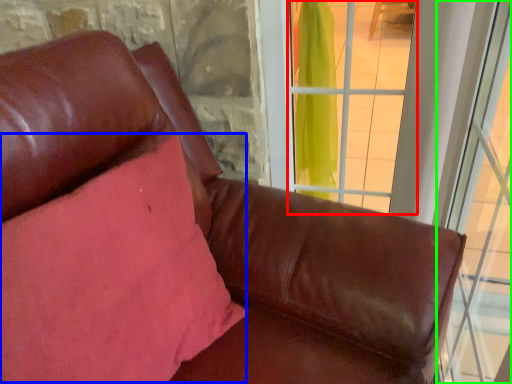
Question: Estimate the real-world distances between objects in this image. Which object is closer to window (highlighted by a red box), pillow (highlighted by a blue box) or window (highlighted by a green box)?

Choices:
 (A) pillow
 (B) window

Answer: (B)